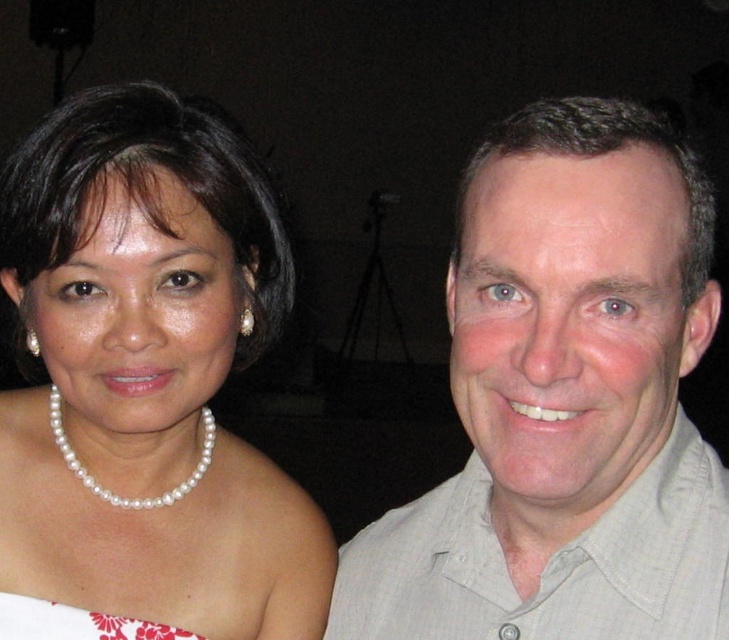
Which is more to the right, light beige shirt at right or pearl necklace at left?

From the viewer's perspective, light beige shirt at right appears more on the right side.

Does point (577, 474) come closer to viewer compared to point (179, 484)?

That is True.

What do you see at coordinates (565, 403) in the screenshot? I see `light beige shirt at right` at bounding box center [565, 403].

Where is `light beige shirt at right`? light beige shirt at right is located at coordinates (565, 403).

Is pearl necklace at center taller than pearl necklace at left?

Correct, pearl necklace at center is much taller as pearl necklace at left.

Can you confirm if pearl necklace at center is positioned below pearl necklace at left?

No, pearl necklace at center is not below pearl necklace at left.

Does point (97, 106) come in front of point (206, 442)?

Yes, point (97, 106) is in front of point (206, 442).

This screenshot has height=640, width=729. In order to click on pearl necklace at center in this screenshot , I will do `click(144, 385)`.

Is point (42, 289) positioned behind point (77, 620)?

Yes, point (42, 289) is behind point (77, 620).

Is pearl necklace at center taller than white floral fabric dress at lower left?

Yes, pearl necklace at center is taller than white floral fabric dress at lower left.

Find the location of a particular element. Image resolution: width=729 pixels, height=640 pixels. pearl necklace at center is located at coordinates [144, 385].